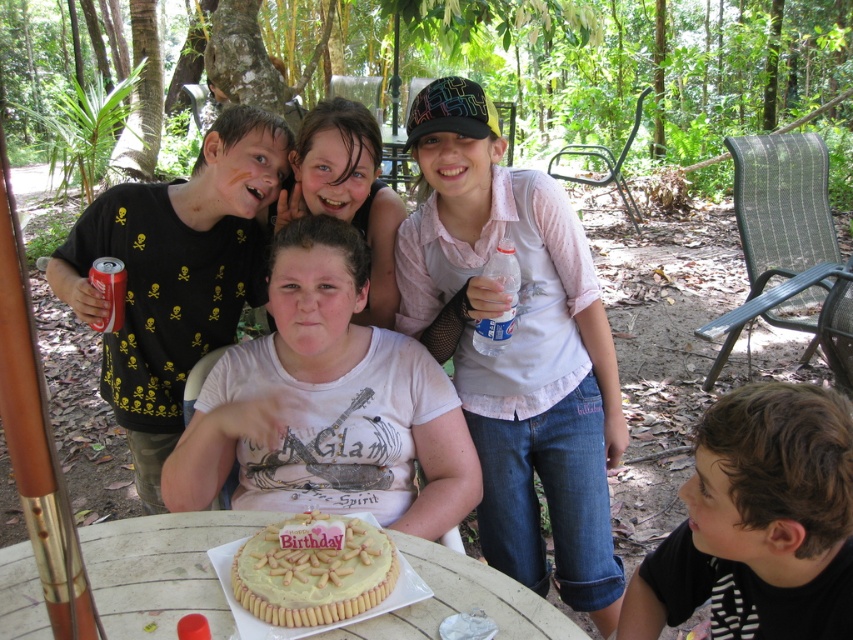
Question: Which point is farther from the camera taking this photo?

Choices:
 (A) (0, 625)
 (B) (550, 177)
 (C) (334, 196)
 (D) (473, 492)

Answer: (C)

Question: Which of the following is the closest to the observer?

Choices:
 (A) matte white shirt at center
 (B) black matte hair at lower right
 (C) yellow frosted cake at center
 (D) white matte shirt at center

Answer: (B)

Question: Which is nearer to the yellow frosted cake at center?

Choices:
 (A) pink fabric shirt at upper center
 (B) wooden round table at center
 (C) matte white shirt at center
 (D) matte white cake at center

Answer: (B)

Question: Does pink fabric shirt at upper center appear over wooden round table at center?

Choices:
 (A) yes
 (B) no

Answer: (A)

Question: Is white matte shirt at center below matte white shirt at center?

Choices:
 (A) yes
 (B) no

Answer: (A)

Question: Can you confirm if yellow frosted cake at center is wider than matte white shirt at center?

Choices:
 (A) yes
 (B) no

Answer: (B)